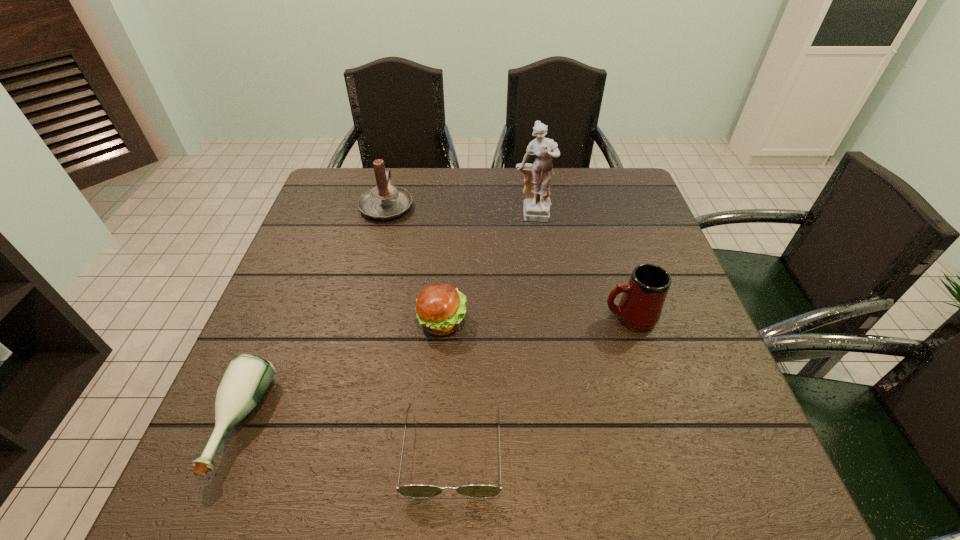
You are a GUI agent. You are given a task and a screenshot of the screen. Output one action in this format:
    pyautogui.click(x=<x>, y=<y>)
    Task: Click on the free space located on the side of the second object from left to right with the handle loop
    This screenshot has height=540, width=960.
    Given the screenshot: What is the action you would take?
    pyautogui.click(x=394, y=177)

Find the location of `free spot located on the side of the second object from left to right with the handle loop`. free spot located on the side of the second object from left to right with the handle loop is located at coordinates (394, 177).

Identify the location of blank area located 0.100m on the side of the second object from left to right with the handle loop. (396, 170).

At what (x,y) coordinates should I click in order to perform the action: click on vacant space located on the side of the rightmost object with the handle. Please return your answer as a coordinate pair (x, y). Looking at the image, I should click on (478, 318).

Where is `vacant space situated 0.170m on the side of the rightmost object with the handle`? vacant space situated 0.170m on the side of the rightmost object with the handle is located at coordinates (527, 318).

Locate an element on the screen. The width and height of the screenshot is (960, 540). vacant space located 0.210m on the side of the rightmost object with the handle is located at coordinates (509, 318).

This screenshot has height=540, width=960. I want to click on free region located 0.280m on the right of the hamburger, so click(x=592, y=321).

At what (x,y) coordinates should I click in order to perform the action: click on free region located 0.350m on the back of the leftmost object. Please return your answer as a coordinate pair (x, y). Looking at the image, I should click on (309, 258).

This screenshot has height=540, width=960. What are the coordinates of `figurine at the far edge` in the screenshot? It's located at (536, 206).

I want to click on candle that is positioned at the far edge, so click(384, 201).